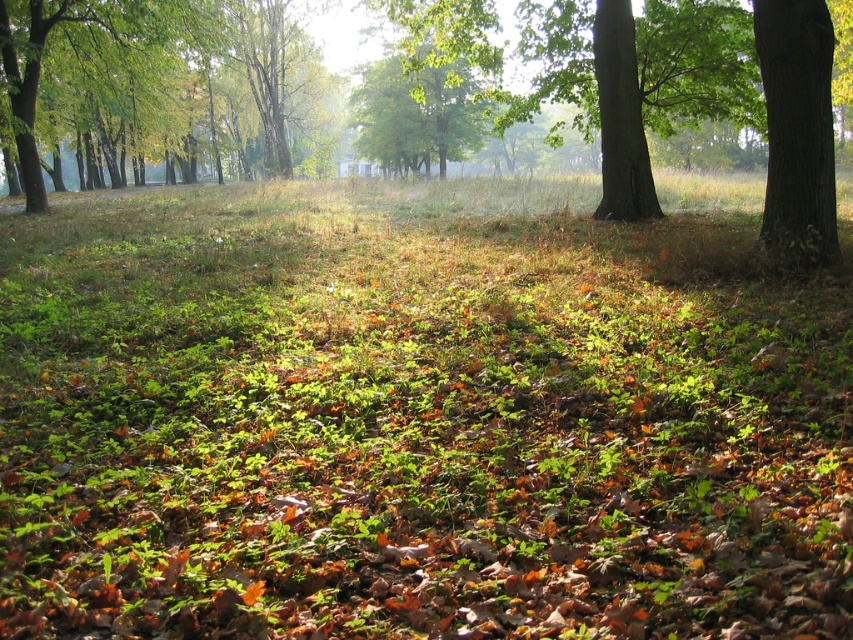
Question: Is green leafy grass at center to the right of green leafy tree at left from the viewer's perspective?

Choices:
 (A) yes
 (B) no

Answer: (A)

Question: Estimate the real-world distances between objects in this image. Which object is closer to the green leafy grass at center?

Choices:
 (A) green rough bark tree at right
 (B) green leafy tree at left

Answer: (A)

Question: Is green leafy grass at center above green leafy tree at left?

Choices:
 (A) no
 (B) yes

Answer: (A)

Question: Which object appears closest to the camera in this image?

Choices:
 (A) green leafy grass at center
 (B) green leafy tree at left
 (C) green rough bark tree at right

Answer: (A)

Question: Which point is farther to the camera?

Choices:
 (A) green leafy grass at center
 (B) green rough bark tree at right

Answer: (B)

Question: In this image, where is green rough bark tree at right located relative to green leafy tree at left?

Choices:
 (A) below
 (B) above

Answer: (A)